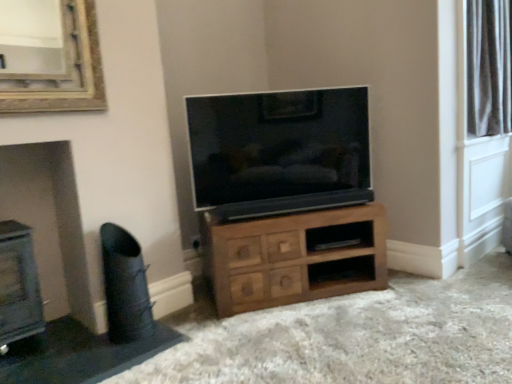
The height and width of the screenshot is (384, 512). Identify the location of vacant region in front of wooden chest of drawers at center. (331, 342).